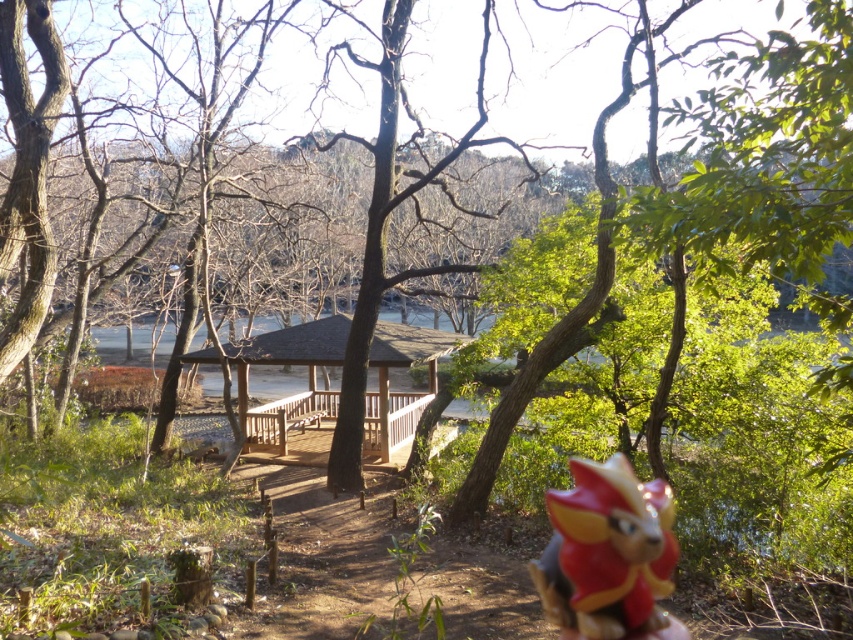
Does point (625, 600) come closer to viewer compared to point (321, 416)?

That is True.

Does point (647, 625) come behind point (332, 324)?

No, it is not.

You are a GUI agent. You are given a task and a screenshot of the screen. Output one action in this format:
    pyautogui.click(x=<x>, y=<y>)
    Task: Click on the shiny plastic toy at lower right
    Image resolution: width=853 pixels, height=640 pixels.
    Given the screenshot: What is the action you would take?
    pyautogui.click(x=607, y=552)